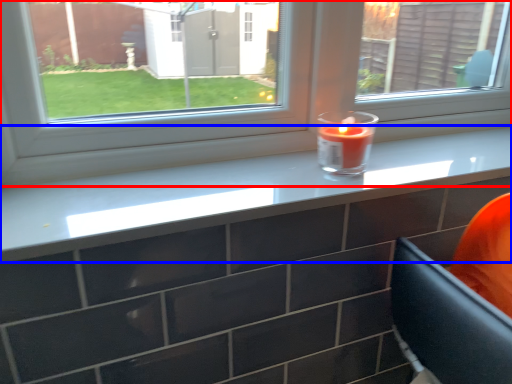
Question: Which point is further to the camera, window (highlighted by a red box) or counter top (highlighted by a blue box)?

Choices:
 (A) window
 (B) counter top

Answer: (A)